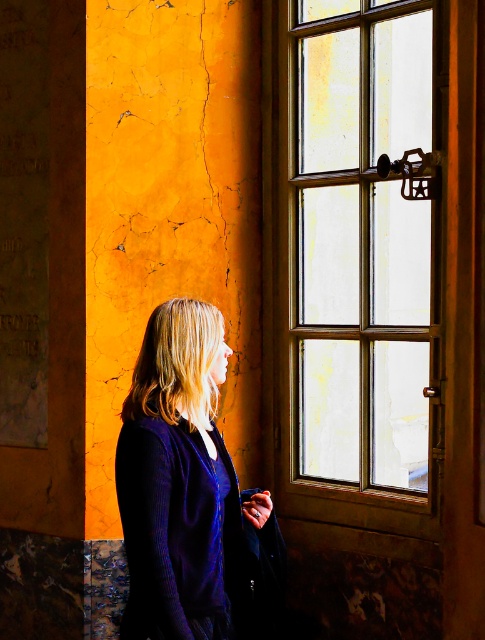
Question: Does wooden window at right appear on the left side of velvet purple sweater at left?

Choices:
 (A) yes
 (B) no

Answer: (B)

Question: Which point appears farthest from the camera in this image?

Choices:
 (A) (215, 316)
 (B) (355, 122)

Answer: (B)

Question: Which point appears farthest from the camera in this image?

Choices:
 (A) (138, 557)
 (B) (316, 154)

Answer: (B)

Question: Can you confirm if wooden window at right is positioned to the left of velvet purple sweater at left?

Choices:
 (A) no
 (B) yes

Answer: (A)

Question: Which point is closer to the camera?

Choices:
 (A) (194, 445)
 (B) (348, 211)

Answer: (A)

Question: Can you confirm if wooden window at right is positioned to the right of velvet purple sweater at left?

Choices:
 (A) yes
 (B) no

Answer: (A)